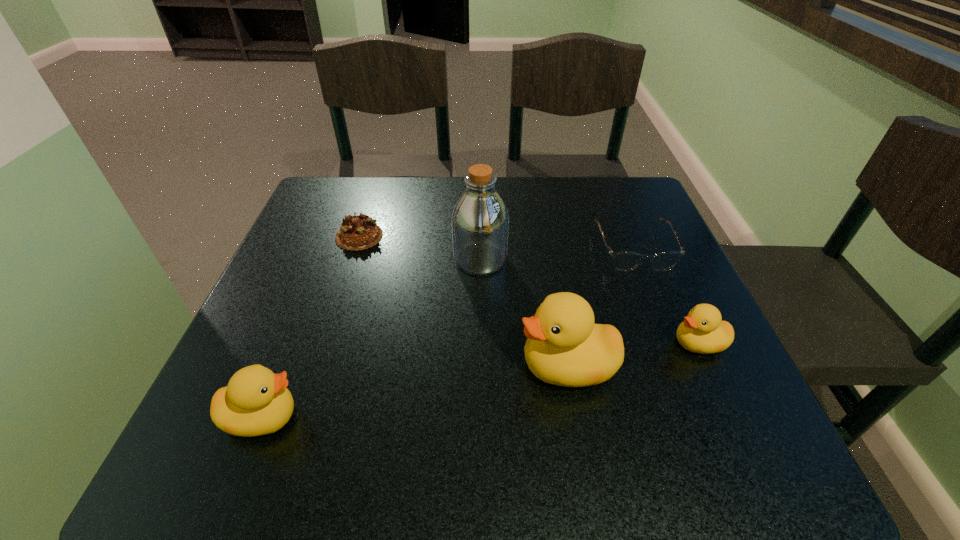
Locate an element on the screen. The width and height of the screenshot is (960, 540). free spot between the chocolate cake and the bottle is located at coordinates (420, 248).

You are a GUI agent. You are given a task and a screenshot of the screen. Output one action in this format:
    pyautogui.click(x=<x>, y=<y>)
    Task: Click on the free spot between the spectacles and the bottle
    This screenshot has width=960, height=540.
    Given the screenshot: What is the action you would take?
    pyautogui.click(x=557, y=254)

The image size is (960, 540). In order to click on free space between the rightmost duckling and the fourth shortest object in this screenshot , I will do `click(480, 380)`.

Locate an element on the screen. unoccupied area between the shortest duckling and the spectacles is located at coordinates (666, 295).

The height and width of the screenshot is (540, 960). What are the coordinates of `object that stands as the fifth closest to the shortest duckling` in the screenshot? It's located at (256, 402).

You are a GUI agent. You are given a task and a screenshot of the screen. Output one action in this format:
    pyautogui.click(x=<x>, y=<y>)
    Task: Click on the fifth closest object to the spectacles
    The height and width of the screenshot is (540, 960).
    Given the screenshot: What is the action you would take?
    pyautogui.click(x=256, y=402)

Identify which duckling is the closest to the third shortest object. Please provide its 2D coordinates. Your answer should be formatted as a tuple, i.e. [(x, y)], where the tuple contains the x and y coordinates of a point satisfying the conditions above.

[(564, 347)]

Image resolution: width=960 pixels, height=540 pixels. I want to click on duckling that is the closest one to the shortest duckling, so click(x=564, y=347).

Locate an element on the screen. The width and height of the screenshot is (960, 540). vacant area that satisfies the following two spatial constraints: 1. on the front-facing side of the spectacles; 2. on the face of the leftmost duckling is located at coordinates (701, 417).